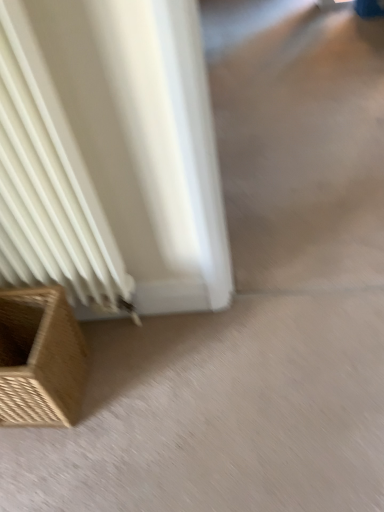
Find the location of `brown woven basket at lower left`. brown woven basket at lower left is located at coordinates (40, 358).

The width and height of the screenshot is (384, 512). What do you see at coordinates (40, 358) in the screenshot?
I see `brown woven basket at lower left` at bounding box center [40, 358].

Describe the element at coordinates (220, 413) in the screenshot. I see `beige carpet at lower left` at that location.

Measure the distance between beige carpet at lower left and camera.

beige carpet at lower left is 35.81 inches from camera.

Identify the location of beige carpet at lower left. The width and height of the screenshot is (384, 512). (220, 413).

Image resolution: width=384 pixels, height=512 pixels. Identify the location of brown woven basket at lower left. (40, 358).

Considering the relative positions of beige carpet at lower left and brown woven basket at lower left in the image provided, is beige carpet at lower left to the right of brown woven basket at lower left from the viewer's perspective?

Indeed, beige carpet at lower left is positioned on the right side of brown woven basket at lower left.

Is beige carpet at lower left in front of or behind brown woven basket at lower left in the image?

Visually, beige carpet at lower left is located behind brown woven basket at lower left.

Does point (381, 409) come farther from viewer compared to point (49, 291)?

No, it is in front of (49, 291).

From the image's perspective, which one is positioned higher, beige carpet at lower left or brown woven basket at lower left?

From the image's view, brown woven basket at lower left is above.

From a real-world perspective, who is located lower, beige carpet at lower left or brown woven basket at lower left?

beige carpet at lower left is physically lower.

Which object is wider, beige carpet at lower left or brown woven basket at lower left?

beige carpet at lower left is wider.

Considering the relative sizes of beige carpet at lower left and brown woven basket at lower left in the image provided, is beige carpet at lower left taller than brown woven basket at lower left?

Incorrect, the height of beige carpet at lower left is not larger of that of brown woven basket at lower left.

Based on their sizes in the image, would you say beige carpet at lower left is bigger or smaller than brown woven basket at lower left?

beige carpet at lower left is smaller than brown woven basket at lower left.

Is beige carpet at lower left positioned beyond the bounds of brown woven basket at lower left?

beige carpet at lower left lies outside brown woven basket at lower left's area.

Is beige carpet at lower left positioned far away from brown woven basket at lower left?

They are positioned close to each other.

Does beige carpet at lower left turn towards brown woven basket at lower left?

No, beige carpet at lower left does not turn towards brown woven basket at lower left.

What's the angular difference between beige carpet at lower left and brown woven basket at lower left's facing directions?

The angle between the facing direction of beige carpet at lower left and the facing direction of brown woven basket at lower left is 179 degrees.

Locate an element on the screen. This screenshot has width=384, height=512. furniture on the left of beige carpet at lower left is located at coordinates (40, 358).

Does brown woven basket at lower left appear on the right side of beige carpet at lower left?

No, brown woven basket at lower left is not to the right of beige carpet at lower left.

Is brown woven basket at lower left in front of or behind beige carpet at lower left in the image?

brown woven basket at lower left is in front of beige carpet at lower left.

Which is closer, [65,383] or [326,331]?

Point [65,383] is closer to the camera than point [326,331].

From the image's perspective, which object appears higher, brown woven basket at lower left or beige carpet at lower left?

brown woven basket at lower left appears higher in the image.

From a real-world perspective, who is located lower, brown woven basket at lower left or beige carpet at lower left?

beige carpet at lower left, from a real-world perspective.

Which object is wider, brown woven basket at lower left or beige carpet at lower left?

Wider between the two is beige carpet at lower left.

From their relative heights in the image, would you say brown woven basket at lower left is taller or shorter than beige carpet at lower left?

brown woven basket at lower left is taller than beige carpet at lower left.

Considering the sizes of objects brown woven basket at lower left and beige carpet at lower left in the image provided, who is bigger, brown woven basket at lower left or beige carpet at lower left?

brown woven basket at lower left is bigger.

Is brown woven basket at lower left surrounding beige carpet at lower left?

No.

Can you see brown woven basket at lower left touching beige carpet at lower left?

brown woven basket at lower left and beige carpet at lower left are not in contact.

Could you tell me if brown woven basket at lower left is facing beige carpet at lower left?

No, brown woven basket at lower left is not aimed at beige carpet at lower left.

Locate an element on the screen. This screenshot has width=384, height=512. furniture located on the left of beige carpet at lower left is located at coordinates 40,358.

I want to click on furniture positioned vertically above the beige carpet at lower left (from a real-world perspective), so click(40, 358).

At what (x,y) coordinates should I click in order to perform the action: click on furniture above the beige carpet at lower left (from the image's perspective). Please return your answer as a coordinate pair (x, y). Image resolution: width=384 pixels, height=512 pixels. Looking at the image, I should click on (40, 358).